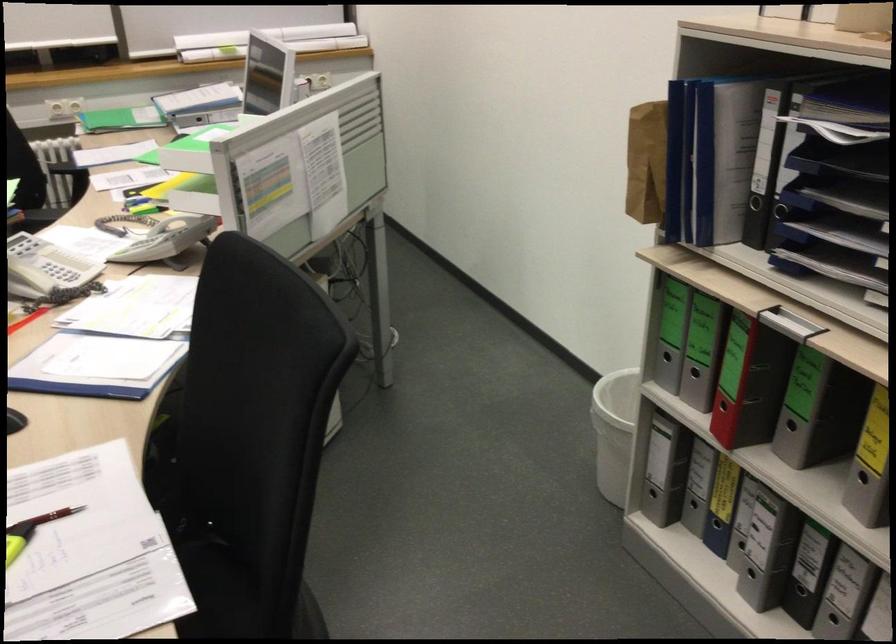
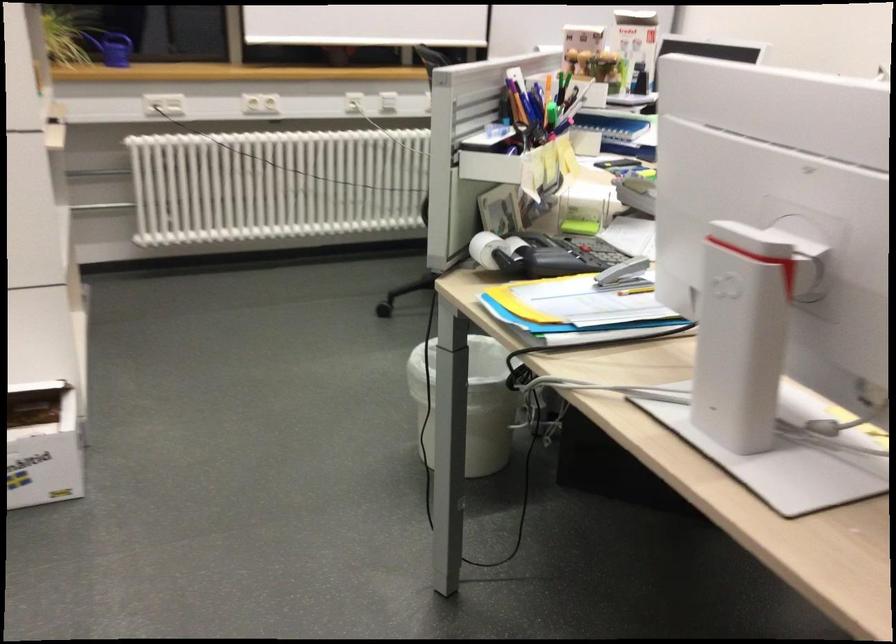
Question: I am providing you with two images of the same scene from different viewpoints. Please identify which objects are invisible in image2.

Choices:
 (A) red pen
 (B) red digital clock
 (C) white paper roll
 (D) telephone handset

Answer: (D)